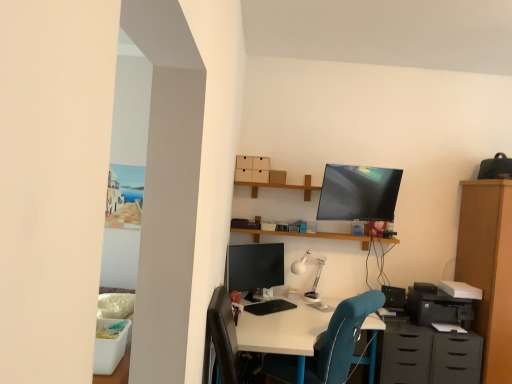
Question: Is wooden shelf at upper center spatially inside white matte desk lamp at center, or outside of it?

Choices:
 (A) outside
 (B) inside

Answer: (A)

Question: Looking at their shapes, would you say wooden shelf at upper center is wider or thinner than white matte desk lamp at center?

Choices:
 (A) thin
 (B) wide

Answer: (A)

Question: Estimate the real-world distances between objects in this image. Which object is farther from the black plastic printer at lower right?

Choices:
 (A) wooden shelf at upper center
 (B) teal fabric chair at center
 (C) matte black monitor at center
 (D) matte black dresser at lower right
 (E) white matte desk lamp at center

Answer: (C)

Question: Which object is positioned closest to the black plastic printer at lower right?

Choices:
 (A) teal fabric chair at center
 (B) white matte desk lamp at center
 (C) matte black dresser at lower right
 (D) matte black monitor at center
 (E) wooden shelf at upper center

Answer: (C)